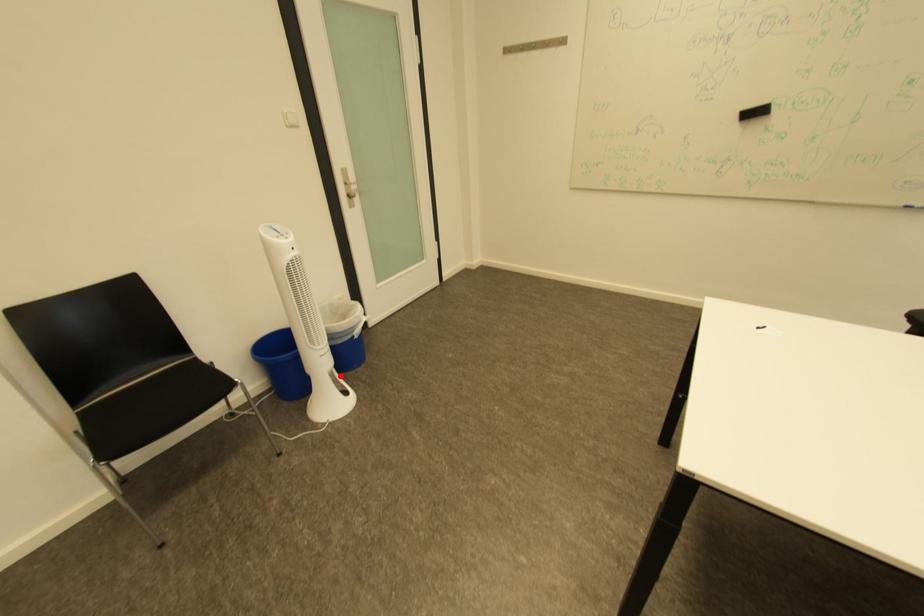
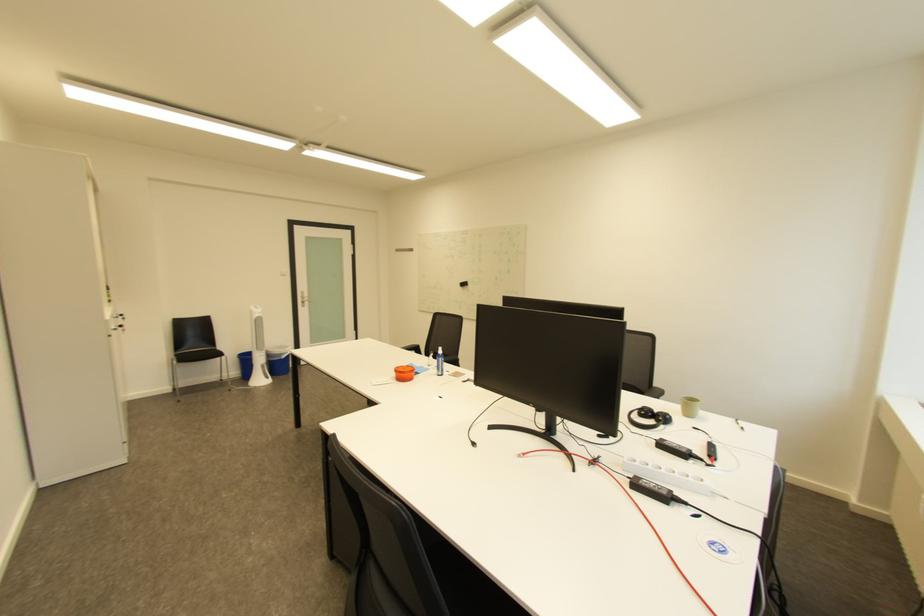
Question: A red point is marked in image1. In image2, is the corresponding 3D point closer to the camera or farther? Reply with the corresponding letter.

Choices:
 (A) The corresponding 3D point is closer.
 (B) The corresponding 3D point is farther.

Answer: (B)